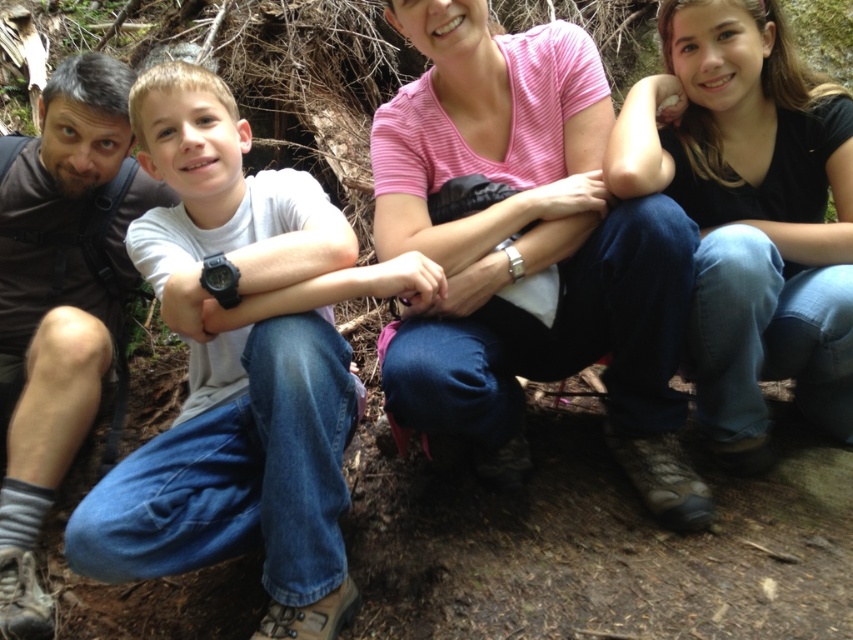
You are standing in front of the image and want to know the distance between the white matte shirt at center and the pink striped shirt at center. Can you tell me how far apart they are?

The white matte shirt at center is 44.02 centimeters away from the pink striped shirt at center.

You are a photographer trying to capture a photo of the pink striped shirt at center and the blue jeans at lower right. Since you can only focus on one subject at a time, which one should you choose to ensure the other remains in the background?

You should focus on the pink striped shirt at center because it is positioned to the left of the blue jeans at lower right, meaning the blue jeans at lower right would naturally fall into the background if the shirt is in focus.

You are standing in front of the group of four people in the forest. You notice two points marked in the image. The first point is at coordinates (166, 467) and the second is at (798, 403). Which point is closer to you?

The point at coordinates (166, 467) is closer to you than the point at (798, 403).